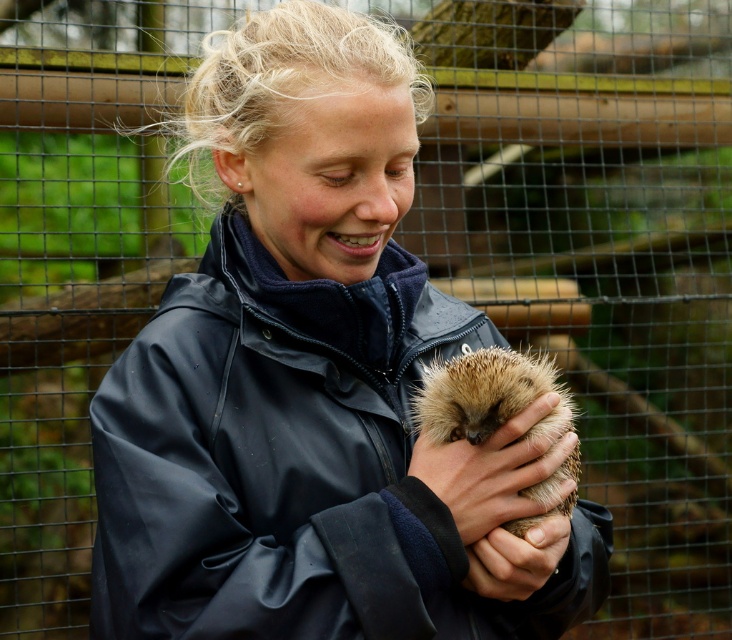
Question: Which object appears farthest from the camera in this image?

Choices:
 (A) smooth brown hand at center
 (B) brown fuzzy hedgehog at center

Answer: (A)

Question: Among these objects, which one is nearest to the camera?

Choices:
 (A) smooth brown hand at center
 (B) brown fuzzy hedgehog at center
 (C) dark blue waterproof jacket at center

Answer: (C)

Question: Among these objects, which one is farthest from the camera?

Choices:
 (A) dark blue waterproof jacket at center
 (B) brown fuzzy hedgehog at center
 (C) smooth brown hand at center

Answer: (C)

Question: Does dark blue waterproof jacket at center have a lesser width compared to brown fuzzy hedgehog at center?

Choices:
 (A) no
 (B) yes

Answer: (A)

Question: Does dark blue waterproof jacket at center come behind smooth brown hand at center?

Choices:
 (A) no
 (B) yes

Answer: (A)

Question: Can you confirm if dark blue waterproof jacket at center is thinner than brown fuzzy hedgehog at center?

Choices:
 (A) no
 (B) yes

Answer: (A)